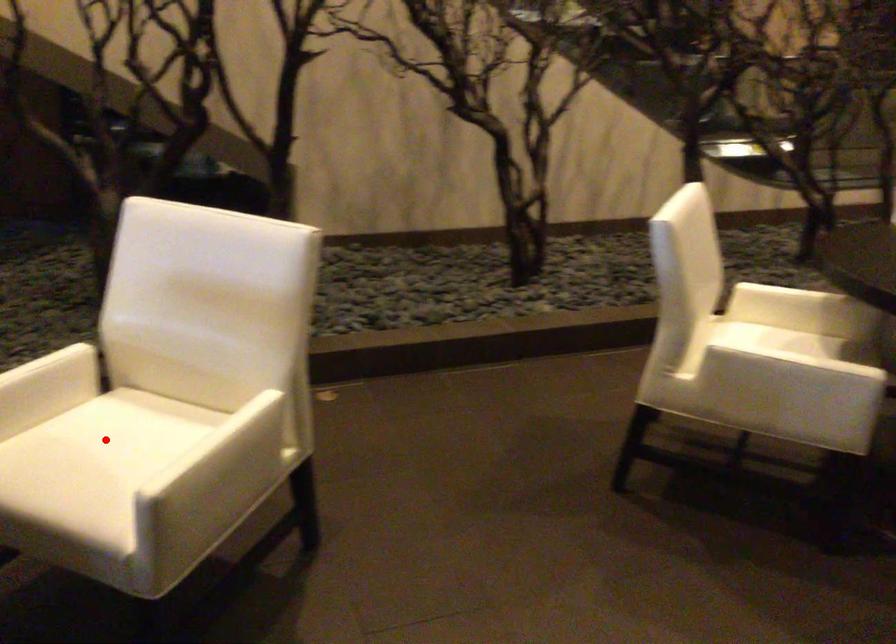
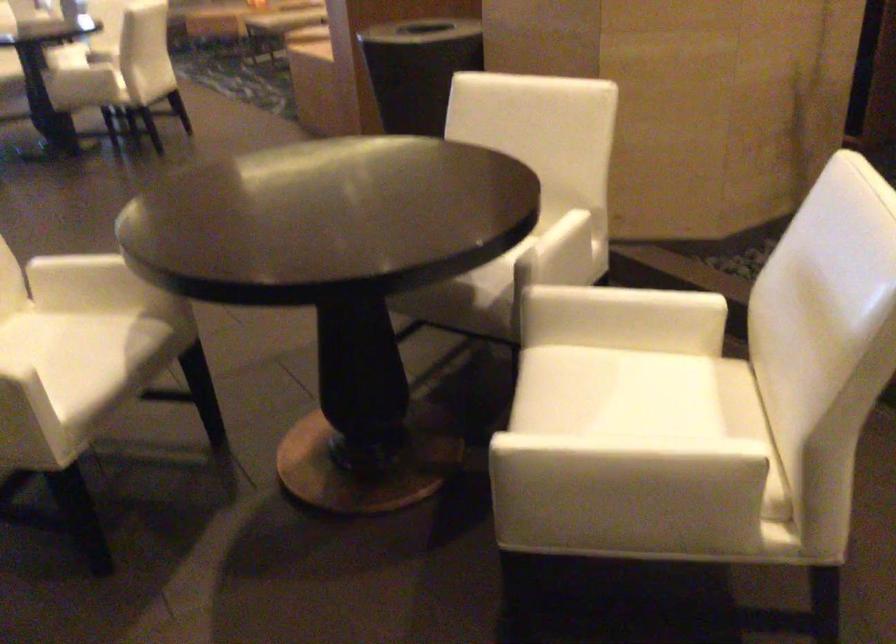
In the second image, find the point that corresponds to the highlighted location in the first image.

(640, 393)